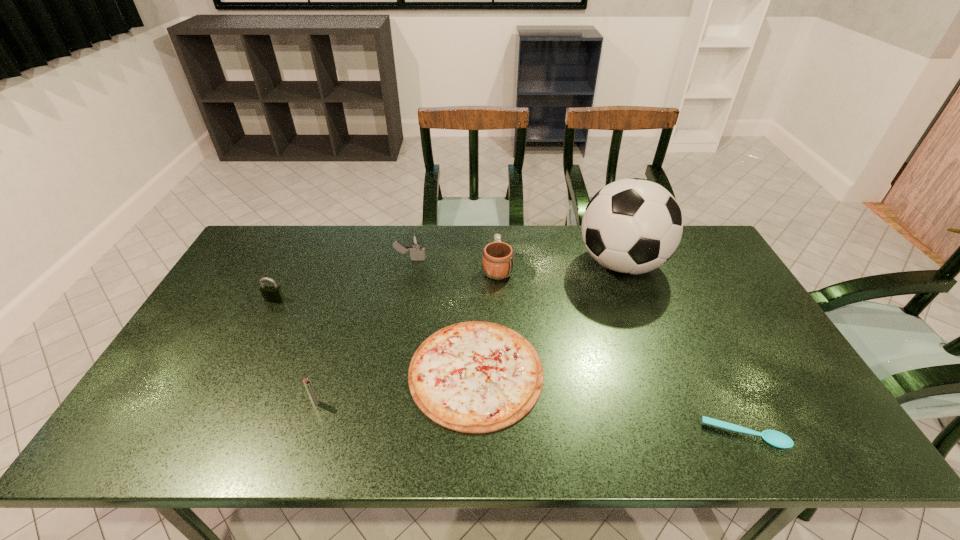
The width and height of the screenshot is (960, 540). What are the coordinates of `vacant space located on the left of the tallest object` in the screenshot? It's located at (476, 264).

The width and height of the screenshot is (960, 540). In order to click on free region located 0.140m on the left of the farther igniter in this screenshot , I will do `click(353, 259)`.

Where is `free location located 0.080m on the side of the mug with the handle`? This screenshot has height=540, width=960. free location located 0.080m on the side of the mug with the handle is located at coordinates (496, 239).

Find the location of a particular element. Image resolution: width=960 pixels, height=540 pixels. free space located 0.160m on the side of the mug with the handle is located at coordinates (495, 226).

Locate an element on the screen. vacant space located on the right of the fourth farthest object is located at coordinates pos(364,300).

Image resolution: width=960 pixels, height=540 pixels. I want to click on free space located 0.260m on the right of the left igniter, so click(x=427, y=402).

In order to click on free point located on the back of the pizza in this screenshot , I will do `click(476, 310)`.

Find the location of a particular element. The image size is (960, 540). free region located on the back of the shortest object is located at coordinates (697, 338).

The image size is (960, 540). In order to click on soccer ball at the far edge in this screenshot , I will do pos(632,226).

You are a GUI agent. You are given a task and a screenshot of the screen. Output one action in this format:
    pyautogui.click(x=<x>, y=<y>)
    Task: Click on the igniter situated at the far edge
    Image resolution: width=960 pixels, height=540 pixels.
    Given the screenshot: What is the action you would take?
    pyautogui.click(x=415, y=246)